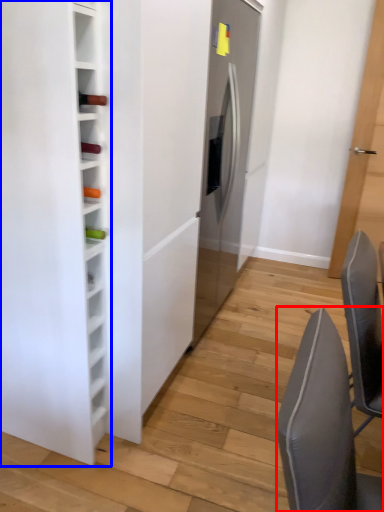
Question: Among these objects, which one is nearest to the camera, chair (highlighted by a red box) or furniture (highlighted by a blue box)?

Choices:
 (A) chair
 (B) furniture

Answer: (A)